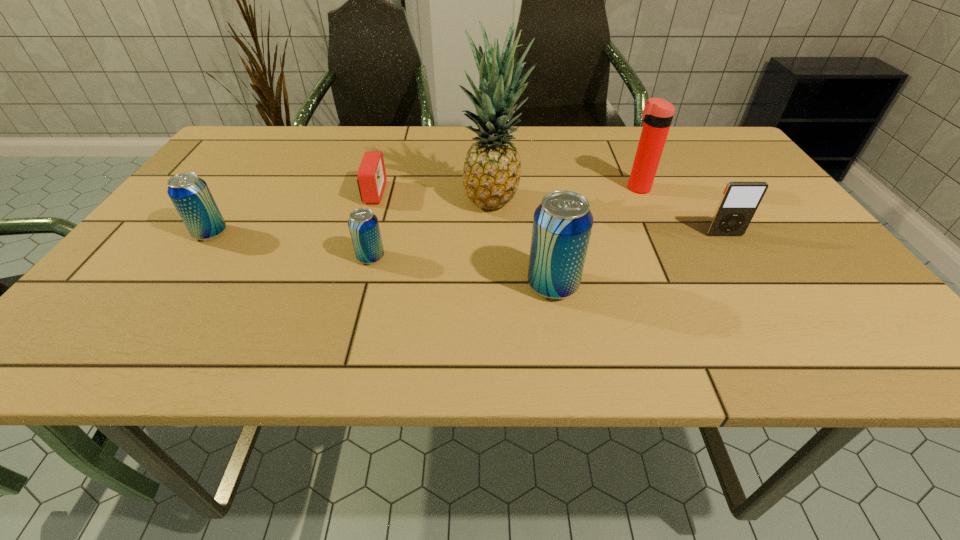
At what (x,y) coordinates should I click in order to perform the action: click on free point that keeps the beer cans evenly spaced on the right. Please return your answer as a coordinate pair (x, y). The image size is (960, 540). Looking at the image, I should click on (761, 317).